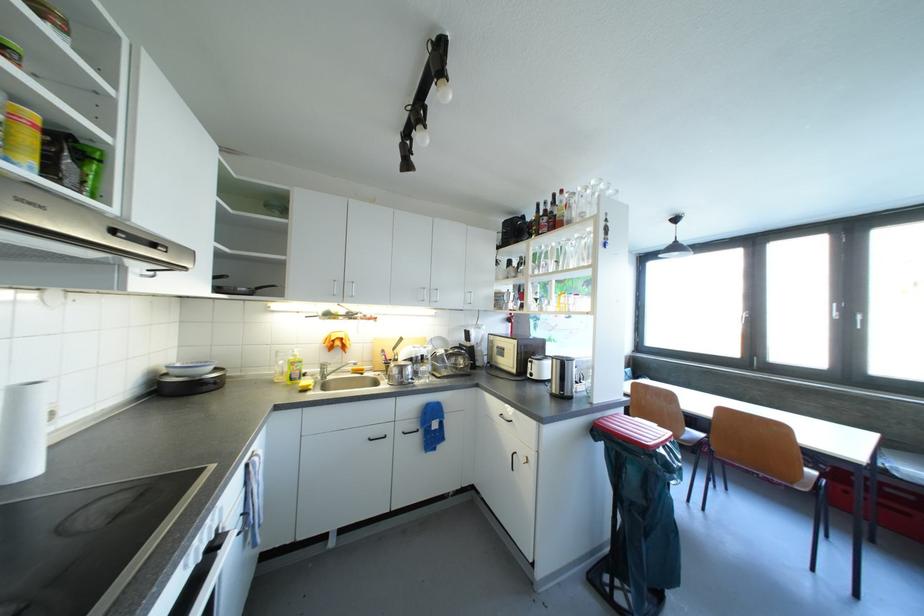
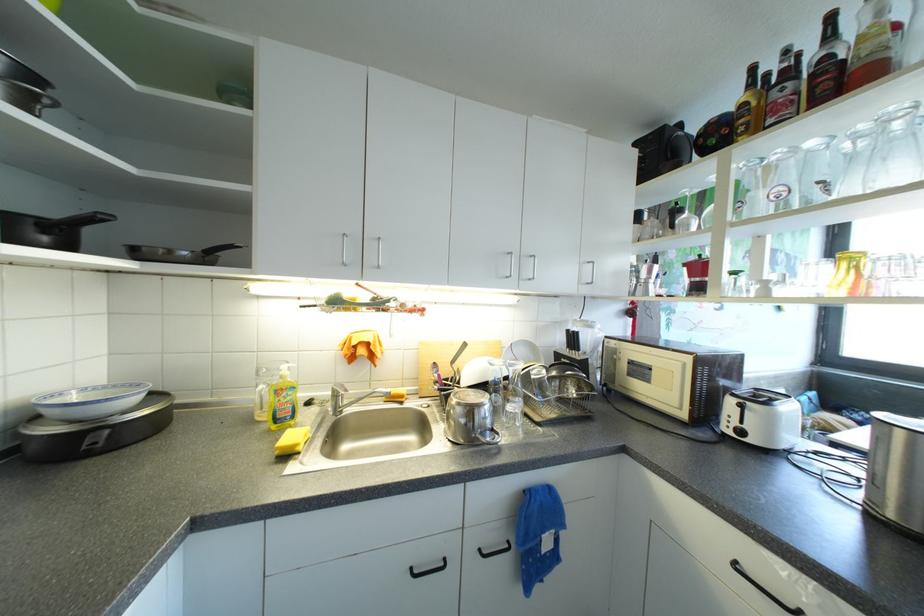
Where in the second image is the point corresponding to point (178, 374) from the first image?

(55, 413)